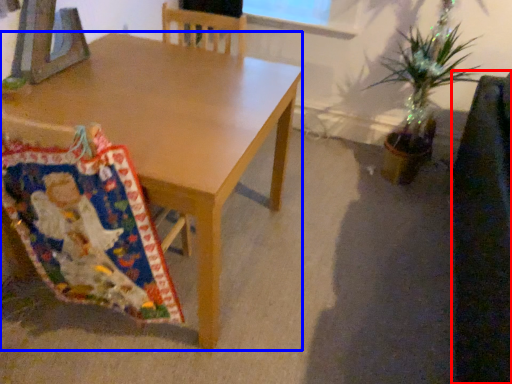
Question: Which point is closer to the camera, swivel chair (highlighted by a red box) or desk (highlighted by a blue box)?

Choices:
 (A) swivel chair
 (B) desk

Answer: (A)